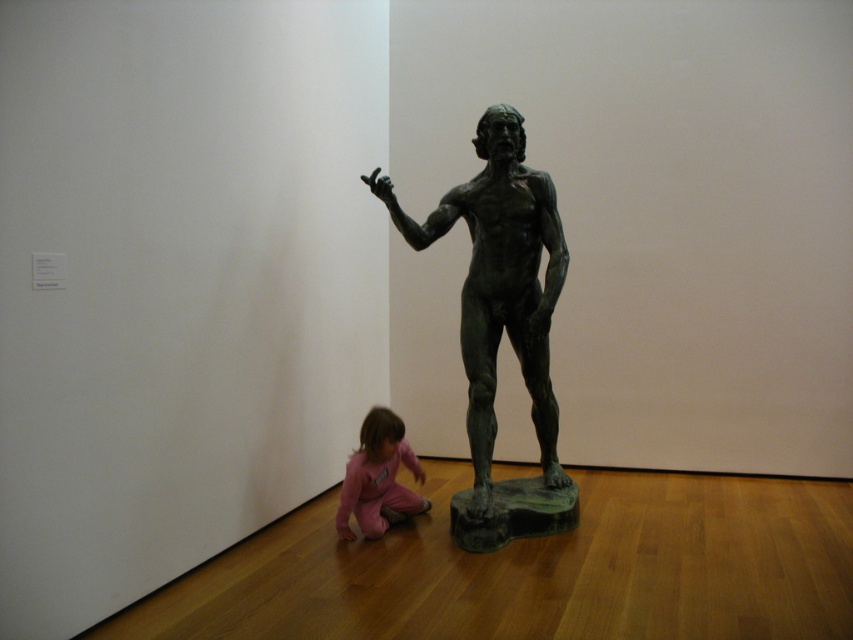
Does green patina bronze statue at center have a greater height compared to pink fabric child at lower center?

Correct, green patina bronze statue at center is much taller as pink fabric child at lower center.

Is green patina bronze statue at center thinner than pink fabric child at lower center?

No, green patina bronze statue at center is not thinner than pink fabric child at lower center.

You are a GUI agent. You are given a task and a screenshot of the screen. Output one action in this format:
    pyautogui.click(x=<x>, y=<y>)
    Task: Click on the green patina bronze statue at center
    The image size is (853, 640).
    Given the screenshot: What is the action you would take?
    (502, 324)